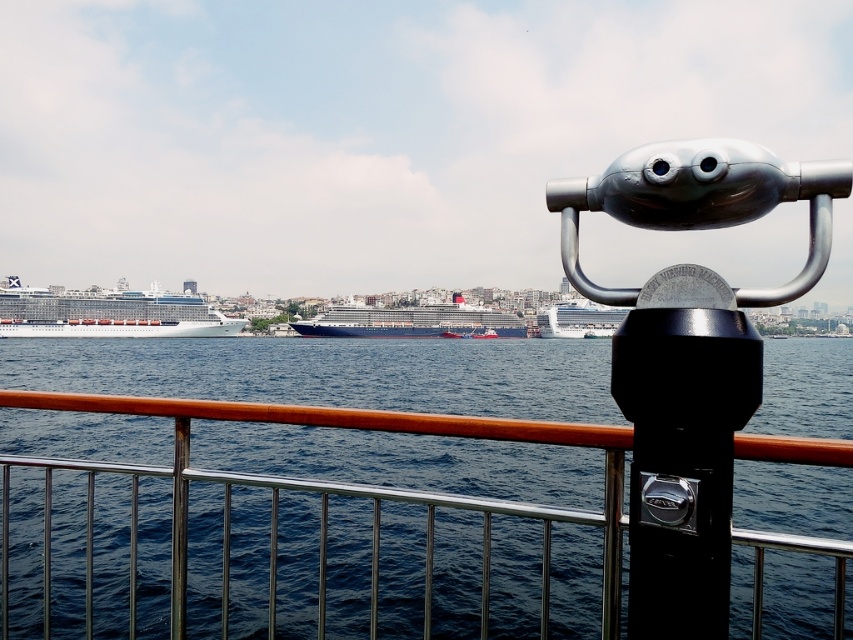
Who is taller, blue metallic cruise ship at left or white glossy cruise ship at center?

blue metallic cruise ship at left is taller.

Is point (56, 296) behind point (579, 333)?

No, it is not.

This screenshot has height=640, width=853. I want to click on blue metallic cruise ship at left, so click(108, 314).

Does blue metallic cruise ship at left have a lesser width compared to blue metallic cruise ship at center?

Indeed, blue metallic cruise ship at left has a lesser width compared to blue metallic cruise ship at center.

You are a GUI agent. You are given a task and a screenshot of the screen. Output one action in this format:
    pyautogui.click(x=<x>, y=<y>)
    Task: Click on the blue metallic cruise ship at left
    The width and height of the screenshot is (853, 640).
    Given the screenshot: What is the action you would take?
    pyautogui.click(x=108, y=314)

Does point (155, 332) lie behind point (427, 324)?

No, (155, 332) is in front of (427, 324).

Identify the location of blue metallic cruise ship at left. (108, 314).

Does dark blue water at center appear on the left side of blue metallic cruise ship at left?

Incorrect, dark blue water at center is not on the left side of blue metallic cruise ship at left.

Who is more distant from viewer, (321, 392) or (49, 324)?

Positioned behind is point (49, 324).

Does point (407, 593) lie behind point (148, 332)?

No, (407, 593) is closer to viewer.

Where is `dark blue water at center`? The image size is (853, 640). dark blue water at center is located at coordinates (332, 372).